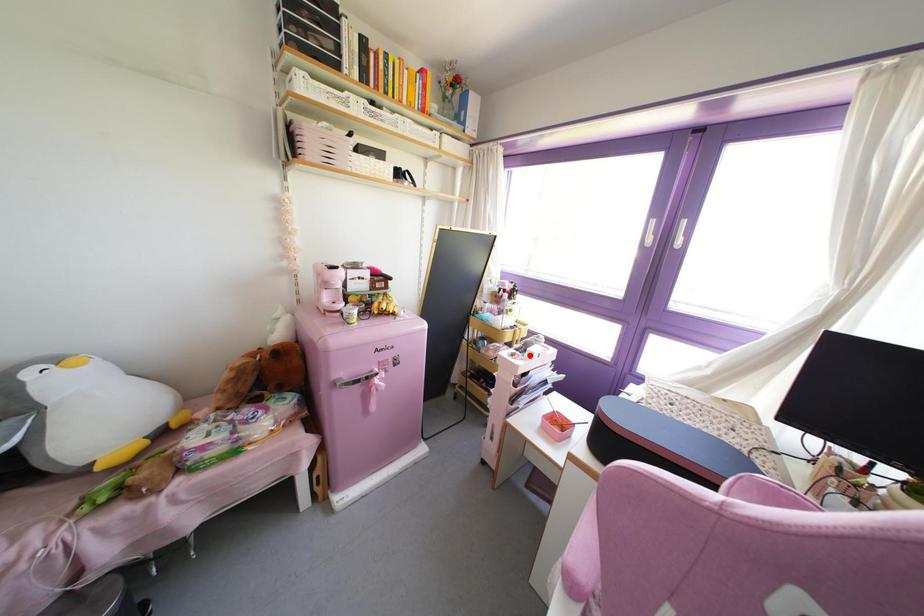
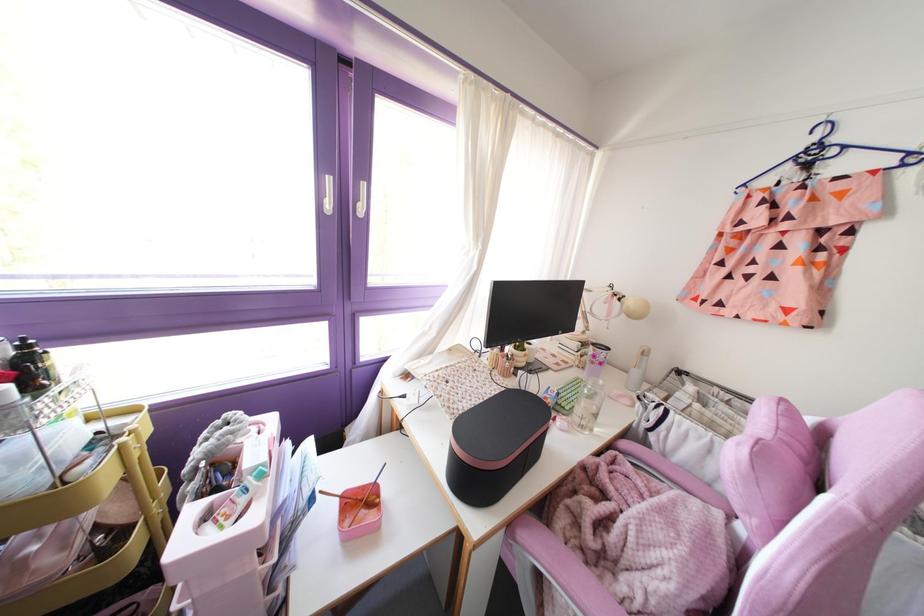
The point at the highlighted location is marked in the first image. Where is the corresponding point in the second image?

(261, 475)